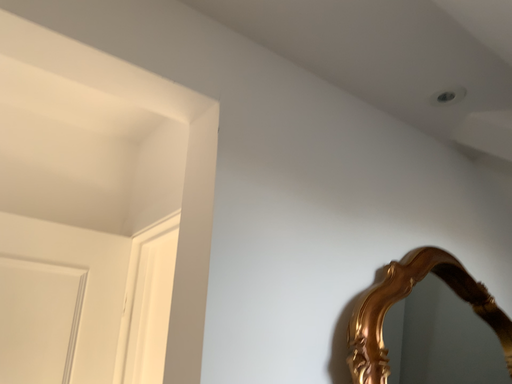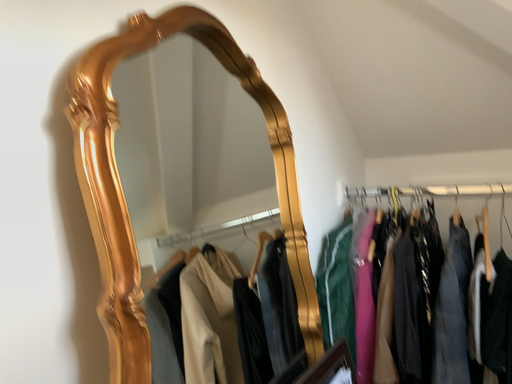
Question: How did the camera likely rotate when shooting the video?

Choices:
 (A) rotated downward
 (B) rotated upward

Answer: (A)